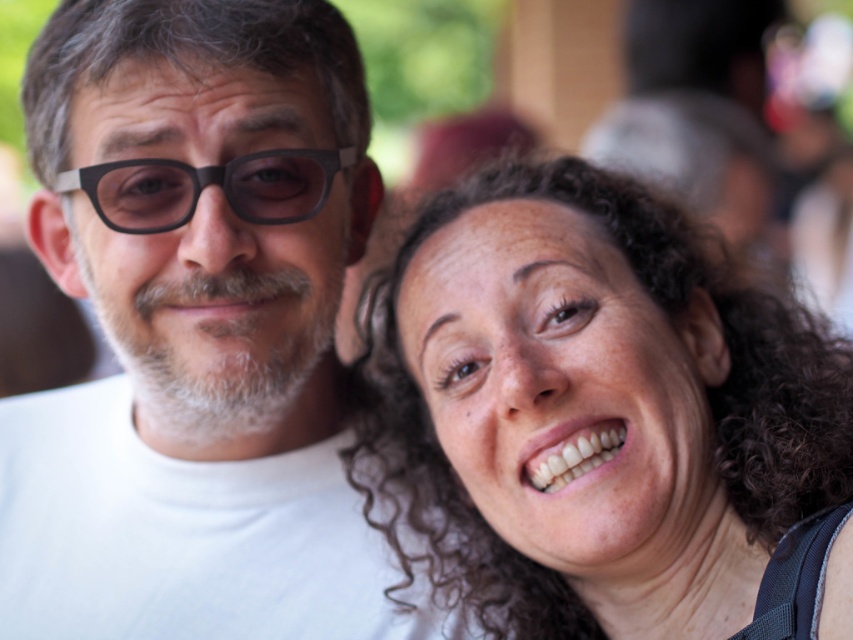
You are a photographer trying to capture a closeup shot of the black plastic glasses at upper left and the curly hair at upper right. Based on their positions, which object should you focus on first to ensure both are in sharp focus?

The curly hair at upper right is closer to the viewer than the black plastic glasses at upper left. To ensure both are in sharp focus, you should focus on the curly hair at upper right first, as it is closer, and the depth of field will naturally include the farther object.

You are a photographer trying to capture a closeup shot of both the curly hair at upper right and the black plastic glasses at upper left in the scene. The camera you are using has a lens that can focus on objects within a 10 inch range. Will you be able to capture both objects in focus without adjusting your camera position?

The distance between the curly hair at upper right and the black plastic glasses at upper left is 12.57 inches, which exceeds the camera lens focus range of 10 inches. Therefore, you will need to adjust your camera position to ensure both objects are within the 10 inch focus range.

You are a photographer trying to capture a closeup of the curly hair at upper right and the black plastic glasses at upper left. Which object is located to the right of the other?

The curly hair at upper right is positioned on the right side of black plastic glasses at upper left.